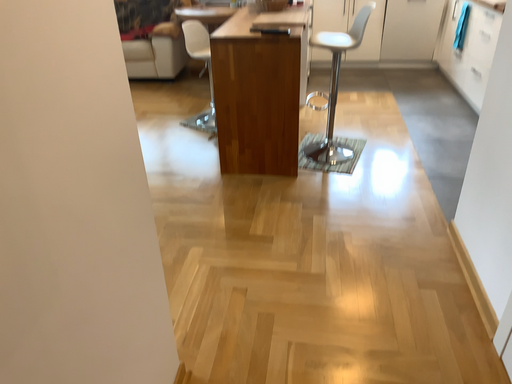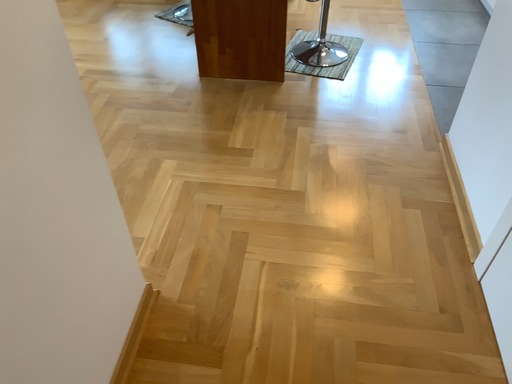
Question: Which way did the camera rotate in the video?

Choices:
 (A) rotated downward
 (B) rotated upward

Answer: (A)